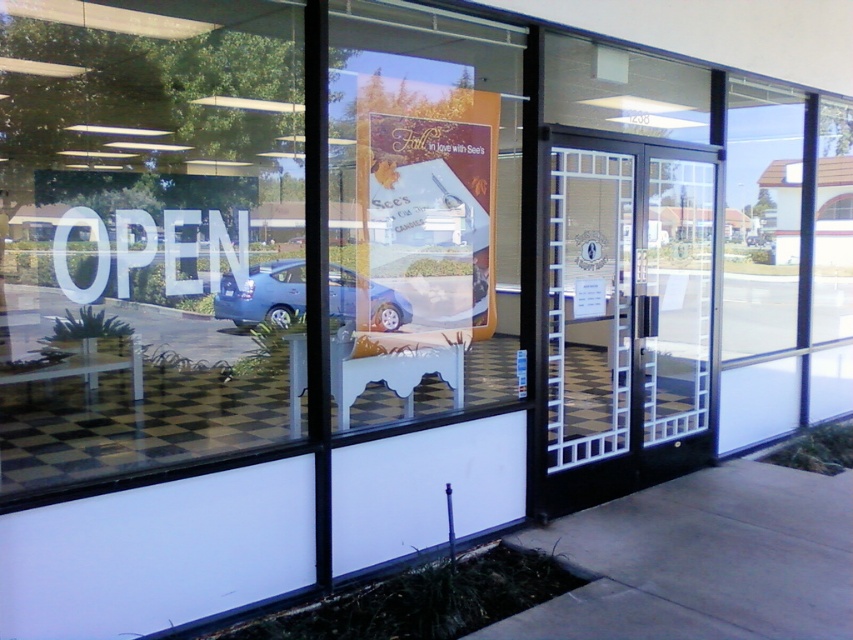
You are a delivery person trying to park your matte blue car at center in front of the store. The store has a checkered floor visible through the glass. The matte orange poster at center is displayed on the window. Since both are at the center, which one is closer to you as you approach the store from the sidewalk?

The matte orange poster at center is closer to you than the matte blue car at center because the poster is on the window, which is part of the store exterior, while the car is parked outside on the sidewalk. Since the poster is attached to the window, it is physically nearer to the observer standing on the sidewalk compared to the car which is further out.

From the picture: You are a customer approaching the entrance of the store. You see the white plastic sign at left and the black glass door at center. Which object is positioned higher relative to the other?

The white plastic sign at left is located above the black glass door at center, so it is positioned higher.